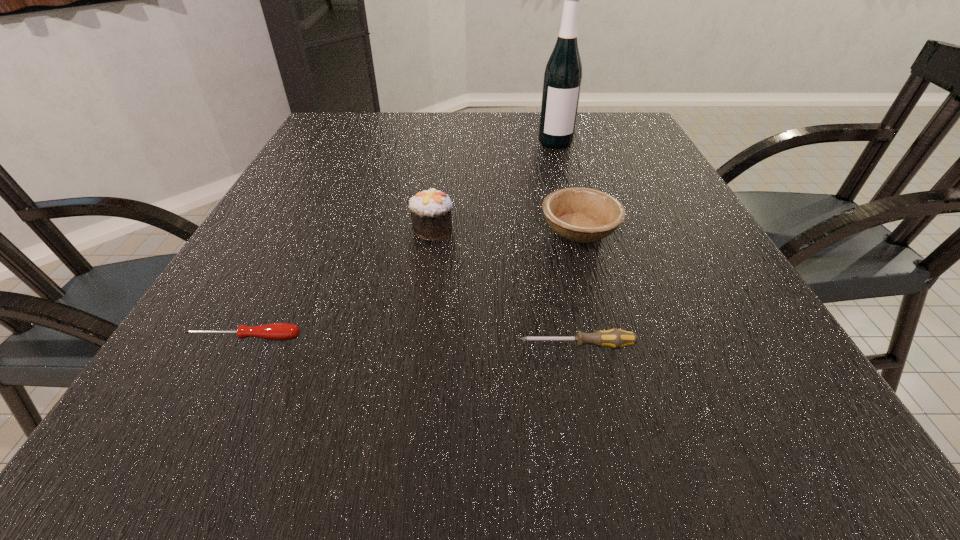
I want to click on the farthest object, so click(562, 81).

This screenshot has height=540, width=960. In order to click on wine bottle in this screenshot , I will do `click(562, 81)`.

Locate an element on the screen. Image resolution: width=960 pixels, height=540 pixels. the second tallest object is located at coordinates (430, 210).

Locate an element on the screen. cupcake is located at coordinates (430, 210).

This screenshot has width=960, height=540. In order to click on the third shortest object in this screenshot , I will do click(583, 215).

The image size is (960, 540). I want to click on the right screwdriver, so click(x=614, y=338).

Locate an element on the screen. The image size is (960, 540). the leftmost object is located at coordinates (276, 331).

This screenshot has width=960, height=540. I want to click on free space located on the label of the tallest object, so click(x=583, y=237).

You are a GUI agent. You are given a task and a screenshot of the screen. Output one action in this format:
    pyautogui.click(x=<x>, y=<y>)
    Task: Click on the free space located on the front of the fourth object from right to left
    
    Given the screenshot: What is the action you would take?
    pyautogui.click(x=426, y=279)

The width and height of the screenshot is (960, 540). What are the coordinates of `vacant space situated 0.190m on the back of the third shortest object` in the screenshot? It's located at (562, 165).